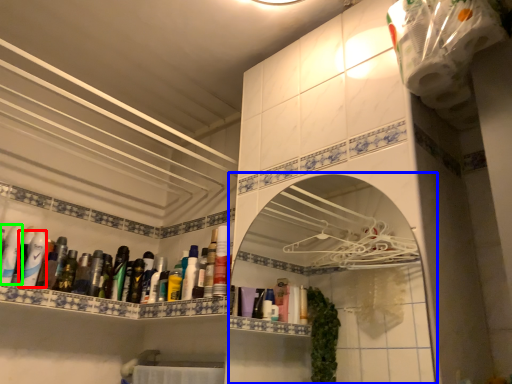
Question: Which object is positioned closest to mouthwash (highlighted by a red box)? Select from medicine cabinet (highlighted by a blue box) and mouthwash (highlighted by a green box).

Choices:
 (A) medicine cabinet
 (B) mouthwash

Answer: (B)